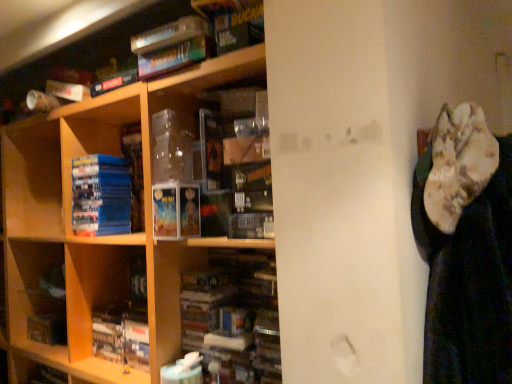
Question: Looking at their shapes, would you say matte paperbacks at center is wider or thinner than blue matte book at left, which is counted as the first book, starting from the top?

Choices:
 (A) thin
 (B) wide

Answer: (A)

Question: Based on their sizes in the image, would you say matte paperbacks at center is bigger or smaller than blue matte book at left, marked as the 2th book in a bottom-to-top arrangement?

Choices:
 (A) big
 (B) small

Answer: (B)

Question: Estimate the real-world distances between objects in this image. Which object is farther from the hardcover book at center, acting as the 1th book starting from the bottom?

Choices:
 (A) blue matte book at left, which is counted as the first book, starting from the top
 (B) matte paperbacks at center
 (C) wooden shelf at center

Answer: (B)

Question: Which object is positioned farthest from the hardcover book at center, placed as the 2th book when sorted from top to bottom?

Choices:
 (A) matte paperbacks at center
 (B) blue matte book at left, which is counted as the first book, starting from the top
 (C) wooden shelf at center

Answer: (A)